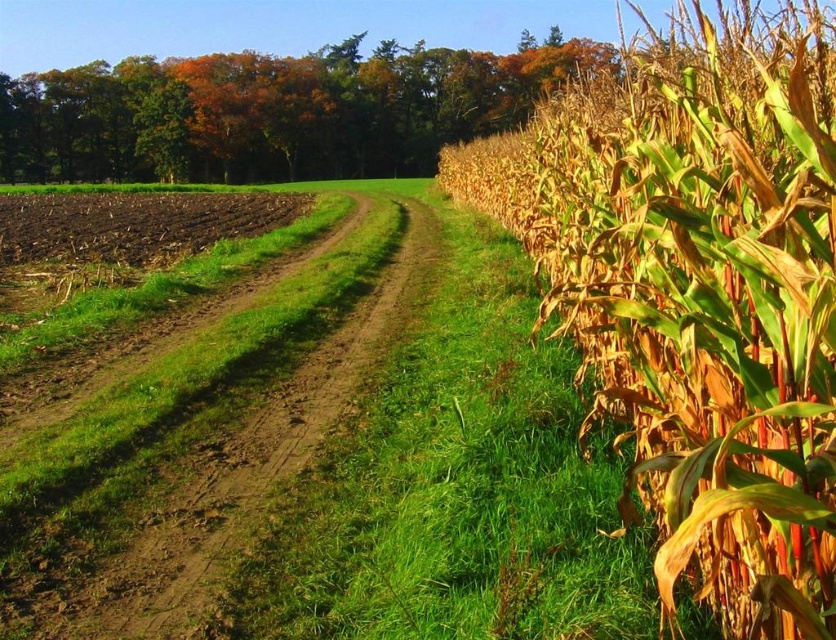
Does yellow-green dried corn at right appear on the right side of brown dirt track at left?

Indeed, yellow-green dried corn at right is positioned on the right side of brown dirt track at left.

From the picture: Between yellow-green dried corn at right and brown dirt track at left, which one is positioned lower?

brown dirt track at left is lower down.

Locate an element on the screen. This screenshot has width=836, height=640. yellow-green dried corn at right is located at coordinates (697, 300).

You are a GUI agent. You are given a task and a screenshot of the screen. Output one action in this format:
    pyautogui.click(x=<x>, y=<y>)
    Task: Click on the yellow-green dried corn at right
    This screenshot has width=836, height=640.
    Given the screenshot: What is the action you would take?
    pyautogui.click(x=697, y=300)